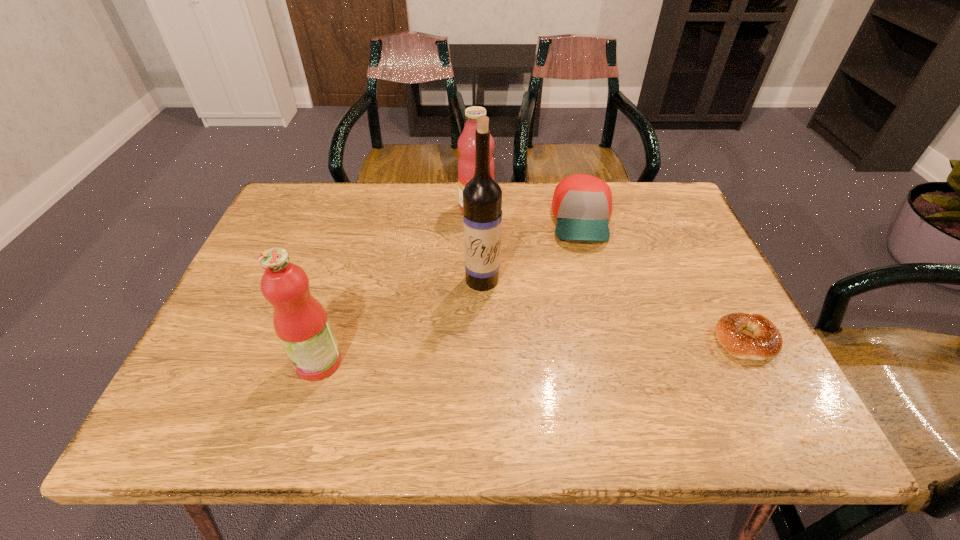
Locate an element on the screen. Image resolution: width=960 pixels, height=540 pixels. free space on the desktop that is between the left fruit juice and the bagel and is positioned at the brim of the fourth tallest object is located at coordinates (596, 348).

Image resolution: width=960 pixels, height=540 pixels. Identify the location of vacant space on the desktop that is between the leftmost object and the rightmost object and is positioned on the label of the farther fruit juice. (498, 353).

The image size is (960, 540). Find the location of `vacant space on the desktop that is between the left fruit juice and the rightmost object and is positioned on the label of the third nearest object`. vacant space on the desktop that is between the left fruit juice and the rightmost object and is positioned on the label of the third nearest object is located at coordinates [x=479, y=354].